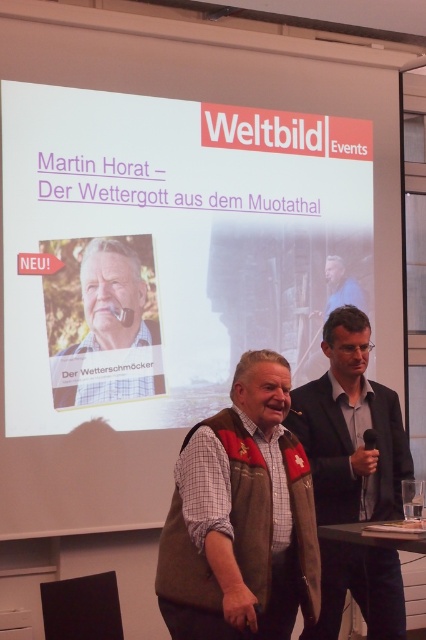
Can you confirm if white matte projector screen at upper center is positioned to the right of leather vest at center?

Incorrect, white matte projector screen at upper center is not on the right side of leather vest at center.

Is white matte projector screen at upper center shorter than leather vest at center?

No, white matte projector screen at upper center is not shorter than leather vest at center.

Which is behind, point (354, 148) or point (242, 561)?

Positioned behind is point (354, 148).

Locate an element on the screen. The image size is (426, 640). white matte projector screen at upper center is located at coordinates (169, 250).

Describe the element at coordinates (351, 429) in the screenshot. Image resolution: width=426 pixels, height=640 pixels. I see `brown leather vest at center` at that location.

Is point (385, 481) positioned before point (104, 317)?

Yes.

You are a GUI agent. You are given a task and a screenshot of the screen. Output one action in this format:
    pyautogui.click(x=<x>, y=<y>)
    Task: Click on the brown leather vest at center
    This screenshot has height=640, width=426.
    Given the screenshot: What is the action you would take?
    pyautogui.click(x=351, y=429)

The height and width of the screenshot is (640, 426). What do you see at coordinates (169, 250) in the screenshot?
I see `white matte projector screen at upper center` at bounding box center [169, 250].

Which is below, white matte projector screen at upper center or brown leather vest at center?

A: brown leather vest at center is lower down.

Is point (314, 209) farther from camera compared to point (354, 401)?

Yes, it is behind point (354, 401).

In order to click on white matte projector screen at upper center in this screenshot , I will do `click(169, 250)`.